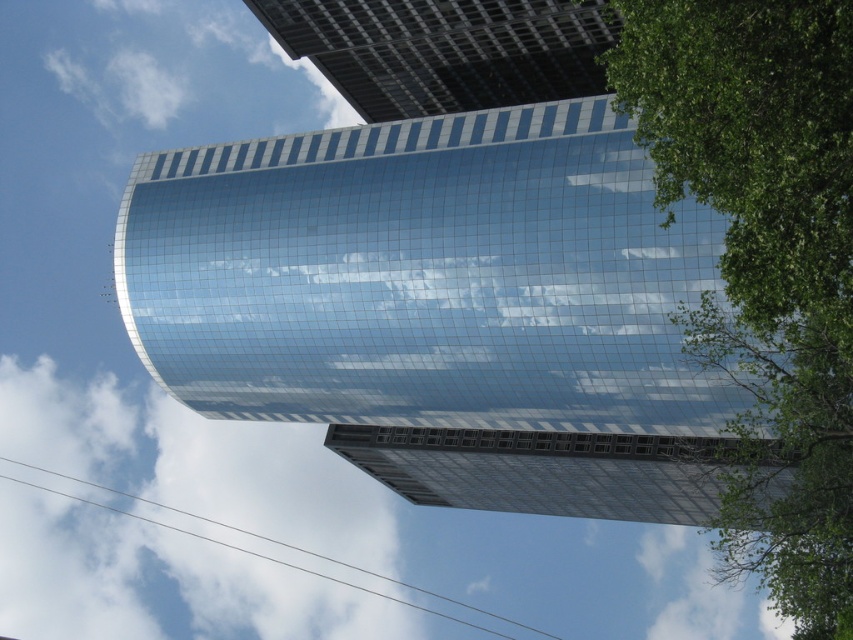
Question: Which object is the closest to the glossy glass tower at center?

Choices:
 (A) white fluffy cloud at upper left
 (B) green leafy tree at right

Answer: (B)

Question: Which point is closer to the camera?

Choices:
 (A) (730, 468)
 (B) (579, 212)
 (C) (277, 618)

Answer: (B)

Question: From the image, what is the correct spatial relationship of green leafy tree at right in relation to white fluffy cloud at upper left?

Choices:
 (A) right
 (B) left

Answer: (A)

Question: Is the position of green leafy tree at right more distant than that of white fluffy cloud at upper left?

Choices:
 (A) no
 (B) yes

Answer: (A)

Question: Which point is closer to the camera?

Choices:
 (A) white fluffy cloud at upper left
 (B) green leafy tree at right

Answer: (B)

Question: Where is glossy glass tower at center located in relation to green leafy tree at right in the image?

Choices:
 (A) below
 (B) above

Answer: (B)